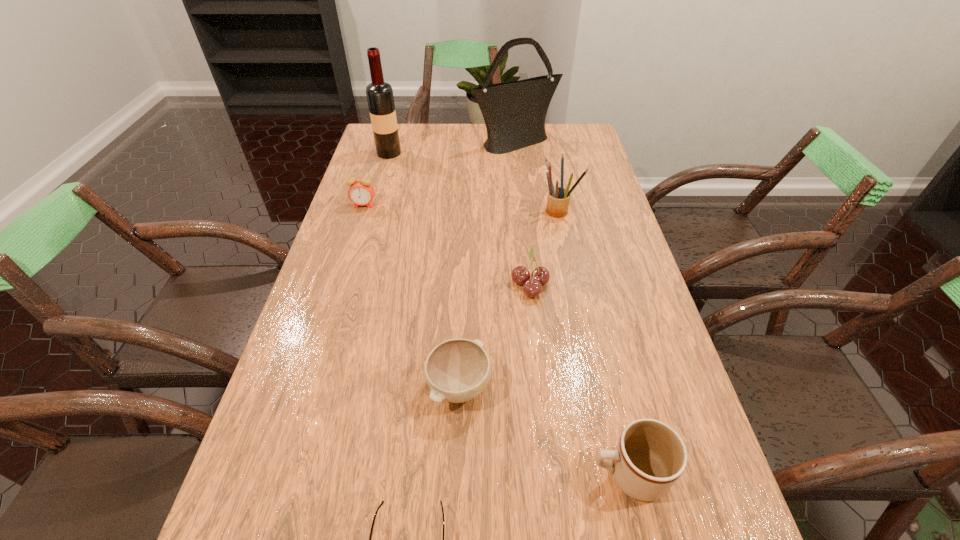
Locate which object is the fifth closest to the shoulder bag. Please provide its 2D coordinates. Your answer should be formatted as a tuple, i.e. [(x, y)], where the tuple contains the x and y coordinates of a point satisfying the conditions above.

[(457, 370)]

The image size is (960, 540). What are the coordinates of `the sixth closest object to the sunglasses` in the screenshot? It's located at (380, 98).

Locate an element on the screen. This screenshot has width=960, height=540. vacant space that satisfies the following two spatial constraints: 1. on the front side of the bowl; 2. on the side of the mug with the handle is located at coordinates [x=455, y=474].

Find the location of `free space that satisfies the following two spatial constraints: 1. on the face of the pencil box; 2. on the right side of the alarm clock`. free space that satisfies the following two spatial constraints: 1. on the face of the pencil box; 2. on the right side of the alarm clock is located at coordinates (362, 210).

Where is `vacant space that satisfies the following two spatial constraints: 1. on the side of the mug with the handle; 2. on the face of the alarm clock`? The height and width of the screenshot is (540, 960). vacant space that satisfies the following two spatial constraints: 1. on the side of the mug with the handle; 2. on the face of the alarm clock is located at coordinates (566, 205).

Identify the location of blank space that satisfies the following two spatial constraints: 1. on the front side of the sixth shortest object; 2. on the side of the mug with the handle. The height and width of the screenshot is (540, 960). (615, 474).